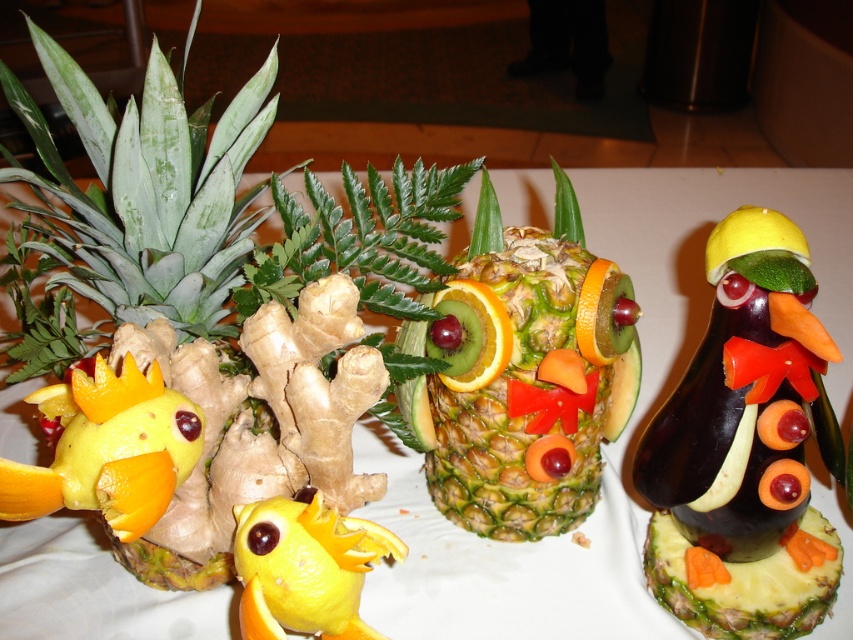
You are arranging a fruit platter and need to place the yellow matte pineapple at lower left and the orange peel slice at center on a small plate. Which fruit should you place first to ensure they both fit?

The yellow matte pineapple at lower left should be placed first because it is wider than the orange peel slice at center, so placing it first ensures there is enough space for both.

From the picture: You are a food stylist arranging fruits on a table. You have a yellow matte pineapple at lower left and an orange peel slice at center. Which fruit is closer to you?

The yellow matte pineapple at lower left is closer to you because it is in front of the orange peel slice at center.